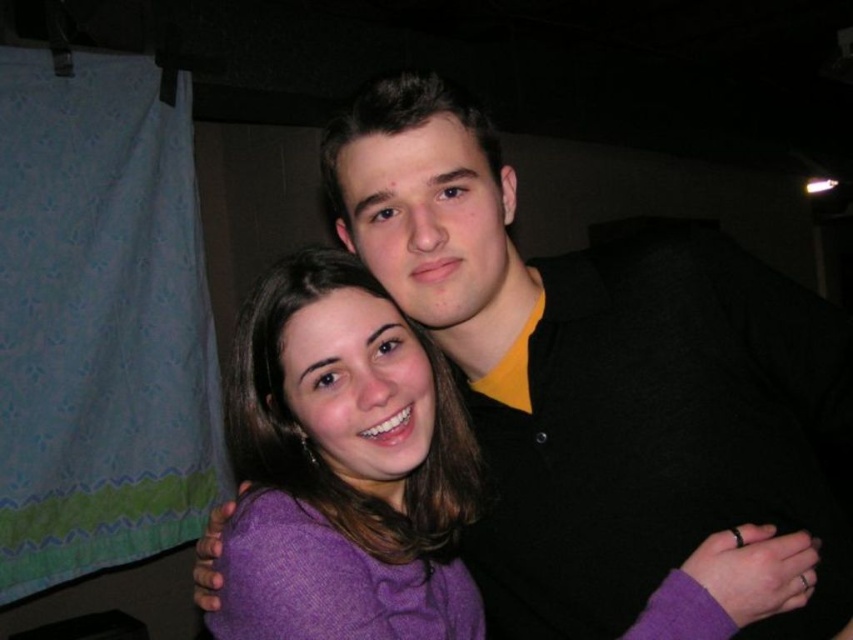
Question: Can you confirm if black matte shirt at upper center is bigger than purple wool sweater at center?

Choices:
 (A) yes
 (B) no

Answer: (A)

Question: Which object is closer to the camera taking this photo?

Choices:
 (A) black matte shirt at upper center
 (B) purple wool sweater at center

Answer: (B)

Question: Which object is closer to the camera taking this photo?

Choices:
 (A) purple wool sweater at center
 (B) black matte shirt at upper center

Answer: (A)

Question: Among these points, which one is farthest from the camera?

Choices:
 (A) (834, 477)
 (B) (343, 273)

Answer: (A)

Question: Does black matte shirt at upper center come behind purple wool sweater at center?

Choices:
 (A) no
 (B) yes

Answer: (B)

Question: From the image, what is the correct spatial relationship of black matte shirt at upper center in relation to purple wool sweater at center?

Choices:
 (A) right
 (B) left

Answer: (A)